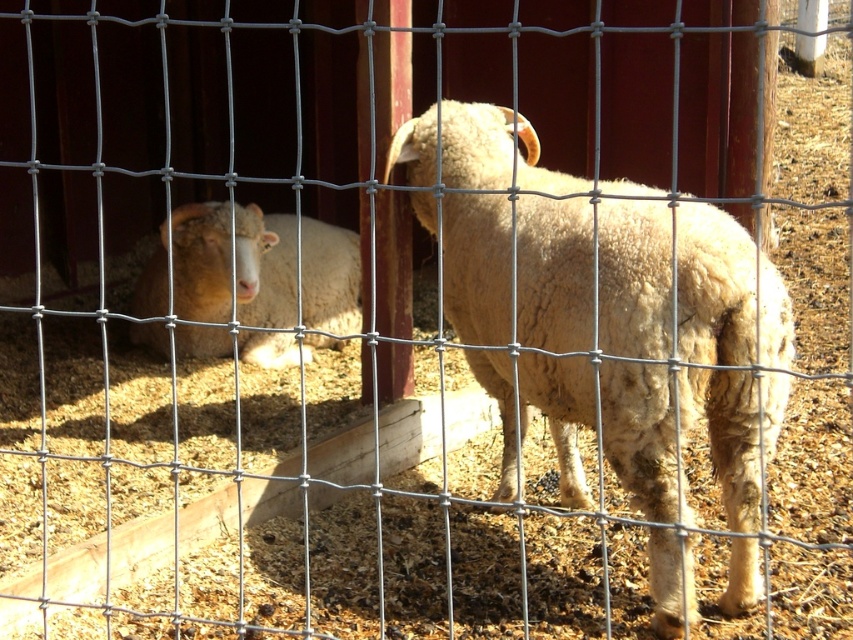
Can you confirm if light beige woolen sheep at center is positioned to the left of fuzzy white sheep at left?

Incorrect, light beige woolen sheep at center is not on the left side of fuzzy white sheep at left.

Between light beige woolen sheep at center and fuzzy white sheep at left, which one appears on the right side from the viewer's perspective?

From the viewer's perspective, light beige woolen sheep at center appears more on the right side.

Between point (413, 204) and point (248, 243), which one is positioned in front?

Point (413, 204)

Where is `light beige woolen sheep at center`? light beige woolen sheep at center is located at coordinates (601, 275).